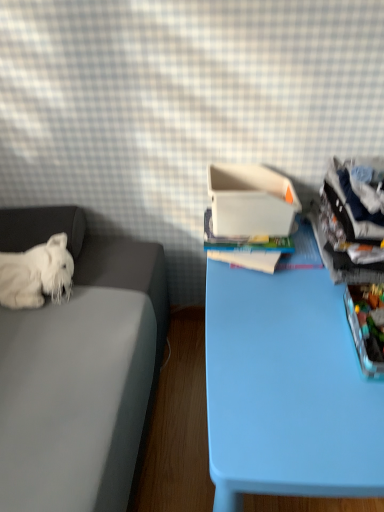
Question: Considering the relative sizes of white plastic container at center and translucent plastic storage box at right in the image provided, is white plastic container at center wider than translucent plastic storage box at right?

Choices:
 (A) no
 (B) yes

Answer: (A)

Question: Considering the relative sizes of white plastic container at center and translucent plastic storage box at right in the image provided, is white plastic container at center shorter than translucent plastic storage box at right?

Choices:
 (A) no
 (B) yes

Answer: (A)

Question: Does white plastic container at center have a smaller size compared to translucent plastic storage box at right?

Choices:
 (A) no
 (B) yes

Answer: (A)

Question: From a real-world perspective, is white plastic container at center below translucent plastic storage box at right?

Choices:
 (A) yes
 (B) no

Answer: (B)

Question: Are white plastic container at center and translucent plastic storage box at right making contact?

Choices:
 (A) yes
 (B) no

Answer: (B)

Question: Is the depth of white plastic container at center less than that of translucent plastic storage box at right?

Choices:
 (A) no
 (B) yes

Answer: (A)

Question: Does white plastic container at center have a greater width compared to white plush dog at left?

Choices:
 (A) yes
 (B) no

Answer: (A)

Question: Is white plastic container at center not close to white plush dog at left?

Choices:
 (A) no
 (B) yes

Answer: (A)

Question: From the image's perspective, does white plastic container at center appear lower than white plush dog at left?

Choices:
 (A) yes
 (B) no

Answer: (B)

Question: Can you confirm if white plastic container at center is smaller than white plush dog at left?

Choices:
 (A) no
 (B) yes

Answer: (A)

Question: From a real-world perspective, is white plastic container at center beneath white plush dog at left?

Choices:
 (A) yes
 (B) no

Answer: (B)

Question: Considering the relative sizes of white plastic container at center and white plush dog at left in the image provided, is white plastic container at center shorter than white plush dog at left?

Choices:
 (A) no
 (B) yes

Answer: (A)

Question: Is light blue plastic table at center far from white plush dog at left?

Choices:
 (A) no
 (B) yes

Answer: (A)